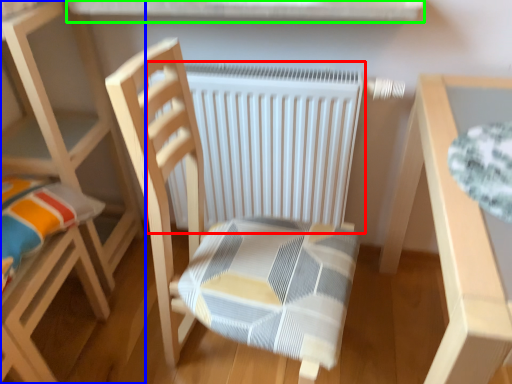
Question: Which is farther away from radiator (highlighted by a red box)? chair (highlighted by a blue box) or window sill (highlighted by a green box)?

Choices:
 (A) chair
 (B) window sill

Answer: (A)